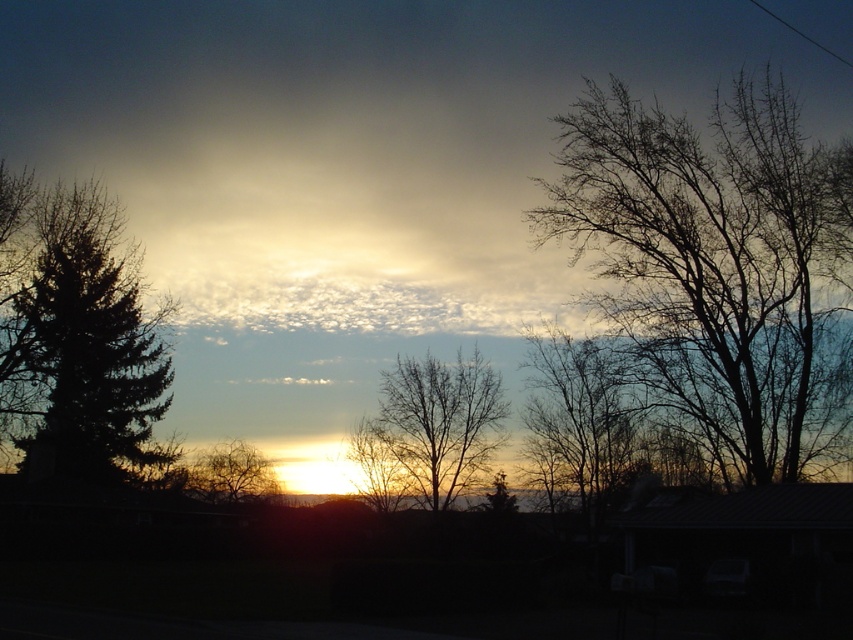
Is dark green coniferous tree at left taller than brown textured tree at center?

Correct, dark green coniferous tree at left is much taller as brown textured tree at center.

Who is more distant from viewer, (38, 433) or (231, 461)?

The point (231, 461) is behind.

At what (x,y) coordinates should I click in order to perform the action: click on dark green coniferous tree at left. Please return your answer as a coordinate pair (x, y). The height and width of the screenshot is (640, 853). Looking at the image, I should click on (76, 337).

In the scene shown: Which is more to the right, bare branches at center or brown textured tree at center?

bare branches at center

In the scene shown: Measure the distance from bare branches at center to brown textured tree at center.

They are 44.04 feet apart.

Measure the distance between bare branches at center and camera.

bare branches at center and camera are 204.91 feet apart.

In order to click on bare branches at center in this screenshot , I will do `click(440, 420)`.

Is dark green coniferous tree at left wider than bare branches at center?

Indeed, dark green coniferous tree at left has a greater width compared to bare branches at center.

In the scene shown: Who is more distant from viewer, (73, 237) or (428, 483)?

Point (428, 483)

You are a GUI agent. You are given a task and a screenshot of the screen. Output one action in this format:
    pyautogui.click(x=<x>, y=<y>)
    Task: Click on the dark green coniferous tree at left
    This screenshot has height=640, width=853.
    Given the screenshot: What is the action you would take?
    pyautogui.click(x=76, y=337)